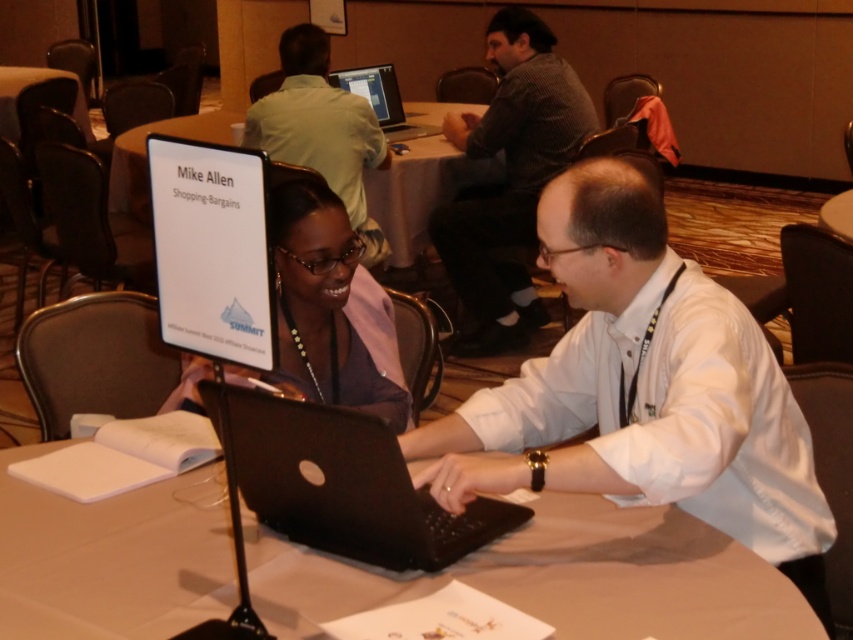
Question: Based on their relative distances, which object is farther from the gray checkered shirt at upper center?

Choices:
 (A) black matte laptop at center
 (B) black glossy laptop at upper center
 (C) matte black laptop at upper center

Answer: (A)

Question: Is black plastic laptop at center smaller than black matte laptop at center?

Choices:
 (A) yes
 (B) no

Answer: (B)

Question: Is white matte shirt at center in front of matte purple shirt at center?

Choices:
 (A) yes
 (B) no

Answer: (A)

Question: Which point is closer to the camera?

Choices:
 (A) black plastic laptop at center
 (B) white paperboard sign at center

Answer: (A)

Question: Which point appears closest to the camera in this image?

Choices:
 (A) (341, 125)
 (B) (193, 116)
 (C) (383, 451)
 (D) (715, 368)

Answer: (C)

Question: Is black matte laptop at center thinner than matte purple shirt at center?

Choices:
 (A) no
 (B) yes

Answer: (B)